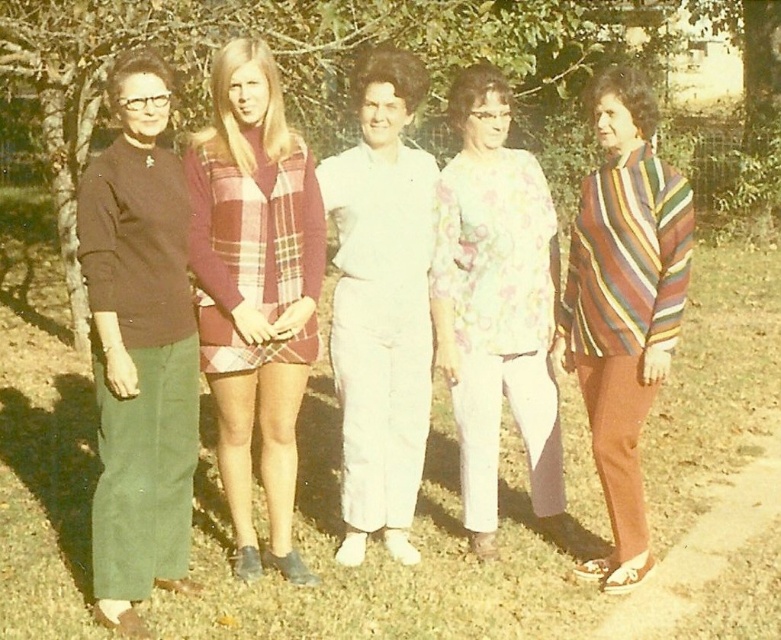
Is floral-patterned fabric blouse at center closer to the viewer compared to striped sweater at right?

No, floral-patterned fabric blouse at center is behind striped sweater at right.

Which is behind, point (476, 179) or point (621, 413)?

Positioned behind is point (476, 179).

Where is `floral-patterned fabric blouse at center`? Image resolution: width=781 pixels, height=640 pixels. floral-patterned fabric blouse at center is located at coordinates (496, 305).

Who is taller, matte brown sweater at left or floral-patterned fabric blouse at center?

With more height is matte brown sweater at left.

Does matte brown sweater at left have a lesser width compared to floral-patterned fabric blouse at center?

Yes, matte brown sweater at left is thinner than floral-patterned fabric blouse at center.

This screenshot has height=640, width=781. I want to click on matte brown sweater at left, so click(x=138, y=348).

Between point (590, 12) and point (293, 572), which one is positioned behind?

The point (590, 12) is more distant.

Which is more to the left, green leafy tree at upper center or plaid fabric dress at center?

Positioned to the left is green leafy tree at upper center.

The image size is (781, 640). Describe the element at coordinates (277, 60) in the screenshot. I see `green leafy tree at upper center` at that location.

The image size is (781, 640). What are the coordinates of `green leafy tree at upper center` in the screenshot? It's located at (277, 60).